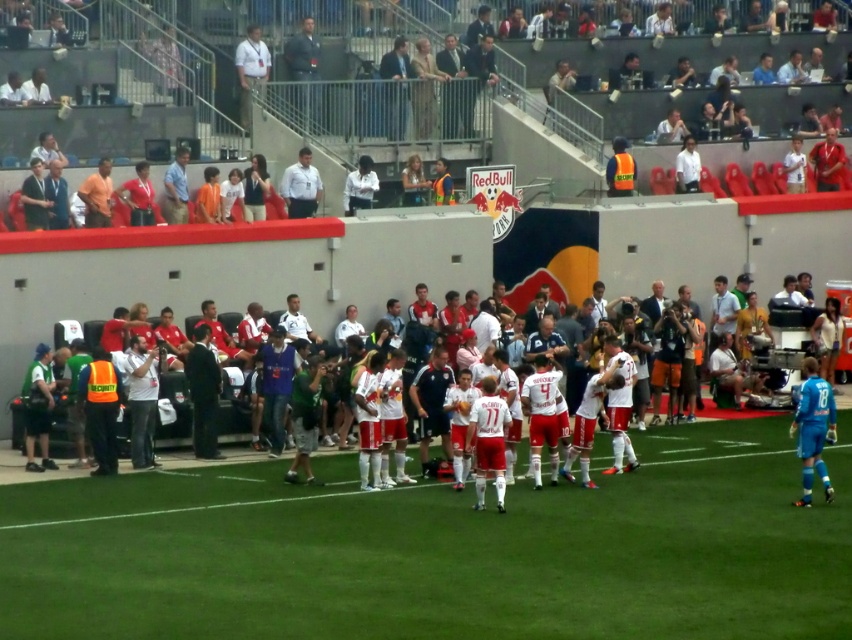
Question: Is white synthetic turf at center to the left of blue smooth jersey at right from the viewer's perspective?

Choices:
 (A) yes
 (B) no

Answer: (A)

Question: Which of the following is the farthest from the observer?

Choices:
 (A) (412, 560)
 (B) (488, 468)
 (C) (613, 177)

Answer: (C)

Question: Observing the image, what is the correct spatial positioning of white shirt at center in reference to white shirt at upper center?

Choices:
 (A) left
 (B) right

Answer: (A)

Question: Which object is farther from the camera taking this photo?

Choices:
 (A) white jersey at center
 (B) high-visibility vest at upper right
 (C) blue smooth jersey at right
 (D) white shirt at upper center

Answer: (D)

Question: Can you confirm if white jersey at center is smaller than white shirt at upper center?

Choices:
 (A) no
 (B) yes

Answer: (A)

Question: Among these points, which one is farthest from the camera?

Choices:
 (A) (136, 477)
 (B) (613, 154)
 (C) (832, 406)
 (D) (13, 468)

Answer: (B)